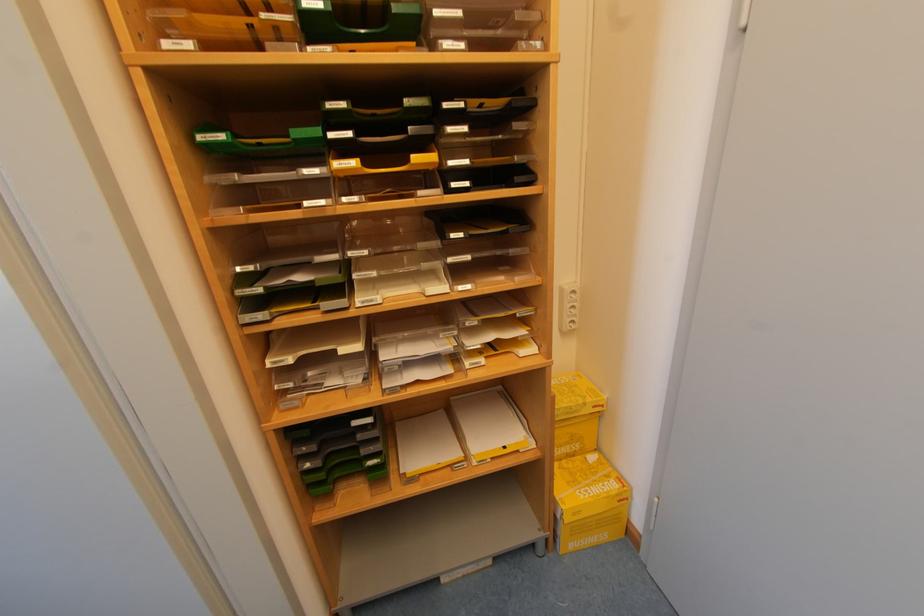
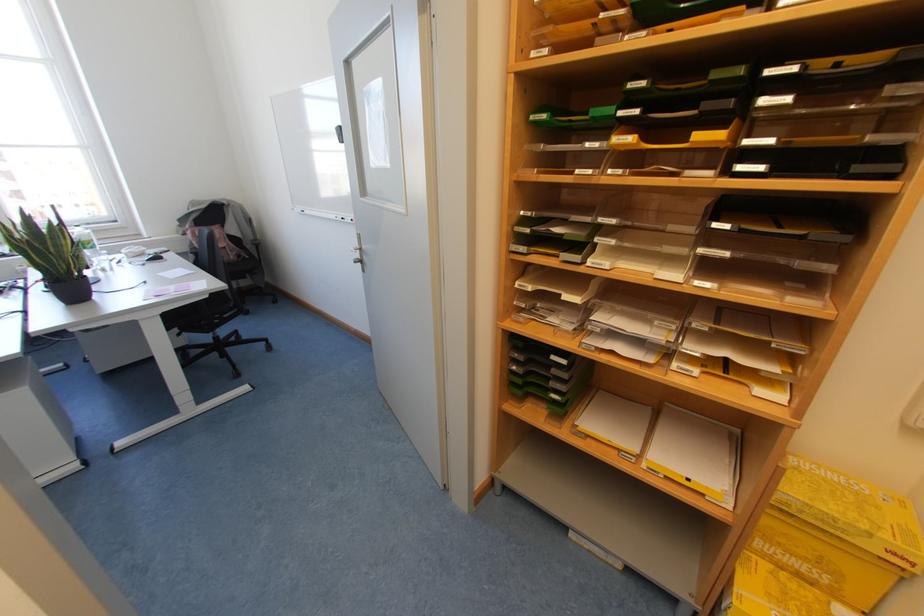
In the second image, find the point that corresponds to point 365,252 in the first image.

(613, 221)